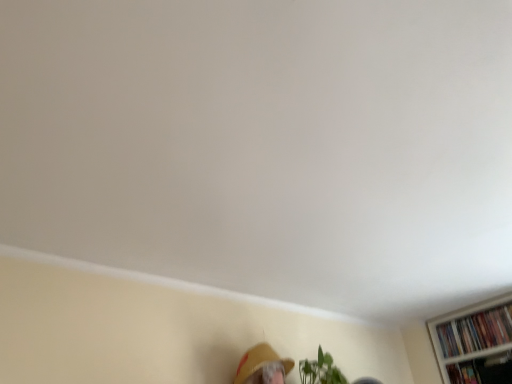
Question: Can we say black matte bookshelf at lower right, positioned as the 1th book in front-to-back order, lies outside matte yellow hat at lower center?

Choices:
 (A) yes
 (B) no

Answer: (A)

Question: From the image's perspective, is black matte bookshelf at lower right, positioned as the 1th book in front-to-back order, below matte yellow hat at lower center?

Choices:
 (A) yes
 (B) no

Answer: (A)

Question: Is black matte bookshelf at lower right, positioned as the 1th book in front-to-back order, facing towards matte yellow hat at lower center?

Choices:
 (A) yes
 (B) no

Answer: (A)

Question: Is black matte bookshelf at lower right, the 2th book viewed from the back, oriented away from matte yellow hat at lower center?

Choices:
 (A) no
 (B) yes

Answer: (A)

Question: Is black matte bookshelf at lower right, the 2th book viewed from the back, smaller than matte yellow hat at lower center?

Choices:
 (A) no
 (B) yes

Answer: (B)

Question: Is black matte bookshelf at lower right, the 2th book viewed from the back, further to the viewer compared to matte yellow hat at lower center?

Choices:
 (A) no
 (B) yes

Answer: (B)

Question: Is matte yellow hat at lower center at the back of multicolored paperbacks at upper right, the 2th book viewed from the front?

Choices:
 (A) yes
 (B) no

Answer: (B)

Question: From the image's perspective, does multicolored paperbacks at upper right, the first book positioned from the back, appear lower than matte yellow hat at lower center?

Choices:
 (A) no
 (B) yes

Answer: (B)

Question: Is multicolored paperbacks at upper right, the 2th book viewed from the front, completely or partially outside of matte yellow hat at lower center?

Choices:
 (A) no
 (B) yes

Answer: (B)

Question: Does multicolored paperbacks at upper right, the 2th book viewed from the front, appear on the left side of matte yellow hat at lower center?

Choices:
 (A) no
 (B) yes

Answer: (A)

Question: Could matte yellow hat at lower center be considered to be inside multicolored paperbacks at upper right, the first book positioned from the back?

Choices:
 (A) no
 (B) yes

Answer: (A)

Question: Are multicolored paperbacks at upper right, the first book positioned from the back, and matte yellow hat at lower center beside each other?

Choices:
 (A) yes
 (B) no

Answer: (B)

Question: Is matte yellow hat at lower center in contact with black matte bookshelf at lower right, positioned as the 1th book in front-to-back order?

Choices:
 (A) no
 (B) yes

Answer: (A)